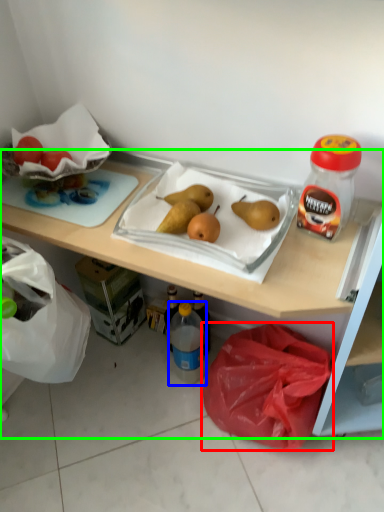
Question: Based on their relative distances, which object is farther from plastic bag (highlighted by a red box)? Choose from bottle (highlighted by a blue box) and desk (highlighted by a green box).

Choices:
 (A) bottle
 (B) desk

Answer: (A)